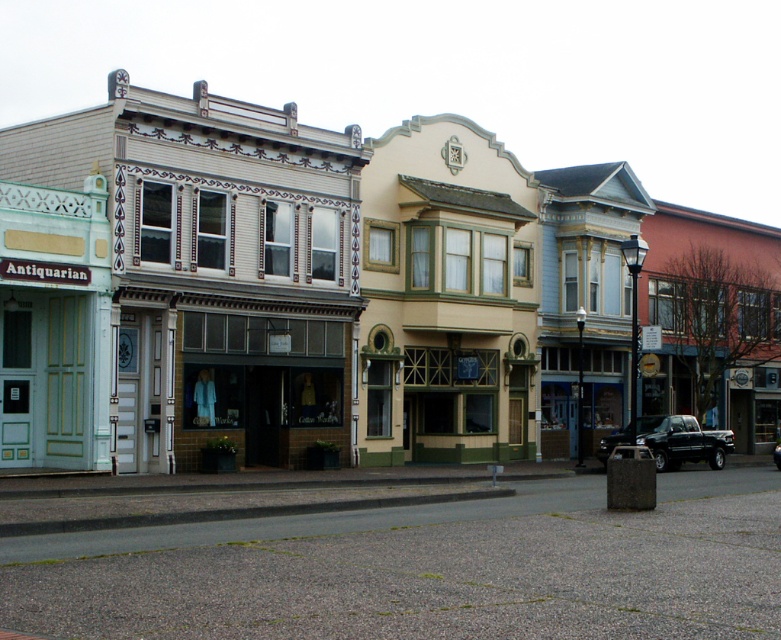
Question: Which object appears farthest from the camera in this image?

Choices:
 (A) matte white building at center
 (B) black matte truck at lower right
 (C) black glossy truck at center

Answer: (C)

Question: Does matte white building at center come behind black matte truck at lower right?

Choices:
 (A) yes
 (B) no

Answer: (B)

Question: Which of the following is the closest to the observer?

Choices:
 (A) (680, 436)
 (B) (337, 440)
 (C) (776, 458)

Answer: (B)

Question: Is matte white building at center positioned in front of black glossy truck at center?

Choices:
 (A) no
 (B) yes

Answer: (B)

Question: Is the position of matte white building at center more distant than that of black matte truck at lower right?

Choices:
 (A) yes
 (B) no

Answer: (B)

Question: Which of the following is the farthest from the observer?

Choices:
 (A) (719, 445)
 (B) (212, 109)

Answer: (A)